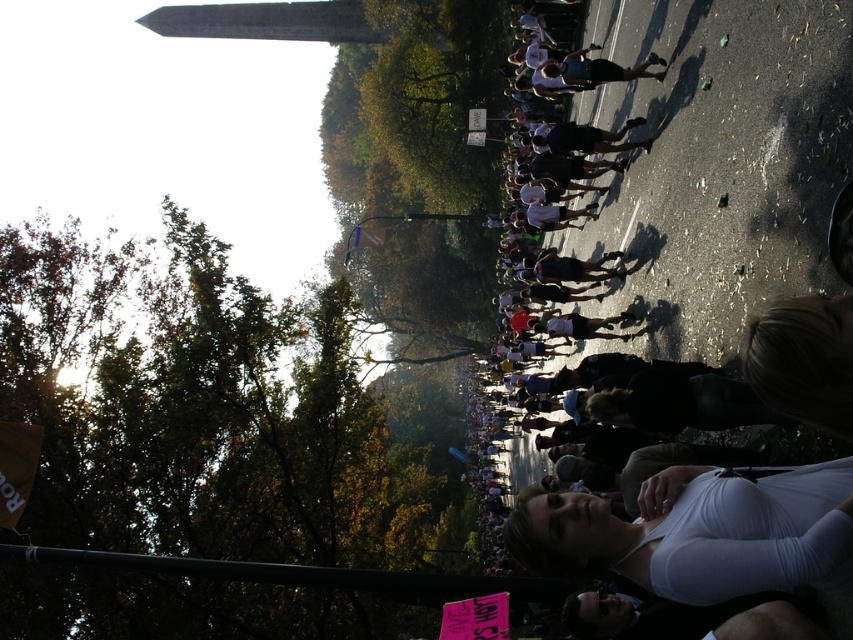
You are a photographer standing at the front of the crowd and want to take a photo of both the dark clothing at center and the white matte shirt at lower right. Which one will be closer to the camera in your photo?

The dark clothing at center will be closer to the camera in your photo because it is positioned further to the viewer than the white matte shirt at lower right.

You are a photographer standing at the edge of the crowd. You want to capture a photo that includes both the dark clothing at center and the white matte shirt at lower right. Given that your camera has a maximum focus range of 40 feet, will you be able to capture both subjects in focus?

The distance between the dark clothing at center and the white matte shirt at lower right is 39.96 feet, which is within the camera maximum focus range of 40 feet. Therefore, you can capture both subjects in focus.

You are a photographer at the event and want to capture both the dark clothing at center and the white matte shirt at lower right in a single shot. Based on their positions, can you frame them so that both are visible without moving your camera position?

The dark clothing at center is located above the white matte shirt at lower right, so yes, you can frame both in your shot by adjusting the camera angle to include the dark clothing at center above and the white matte shirt at lower right below.